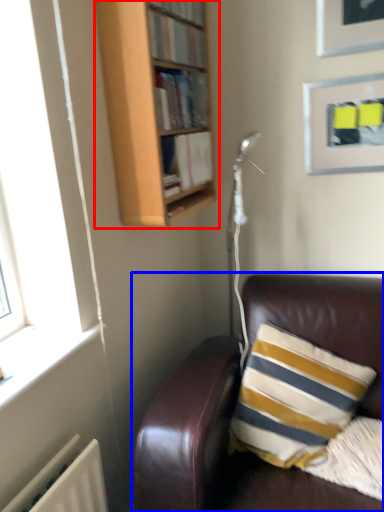
Question: Which object is closer to the camera taking this photo, bookcase (highlighted by a red box) or studio couch (highlighted by a blue box)?

Choices:
 (A) bookcase
 (B) studio couch

Answer: (B)